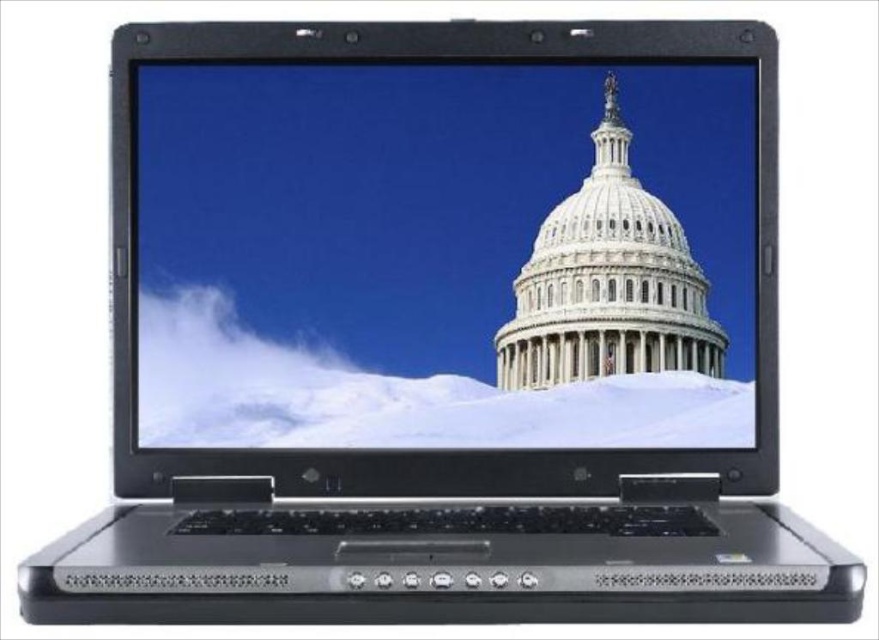
Question: From the image, what is the correct spatial relationship of white glossy dome at center in relation to white marble dome at center?

Choices:
 (A) below
 (B) above

Answer: (A)

Question: Can you confirm if white glossy dome at center is positioned to the right of white marble dome at center?

Choices:
 (A) yes
 (B) no

Answer: (B)

Question: Which object is closer to the camera taking this photo?

Choices:
 (A) white marble dome at center
 (B) white glossy dome at center

Answer: (B)

Question: Where is white glossy dome at center located in relation to white marble dome at center in the image?

Choices:
 (A) above
 (B) below

Answer: (B)

Question: Which point appears farthest from the camera in this image?

Choices:
 (A) (354, 320)
 (B) (534, 376)

Answer: (B)